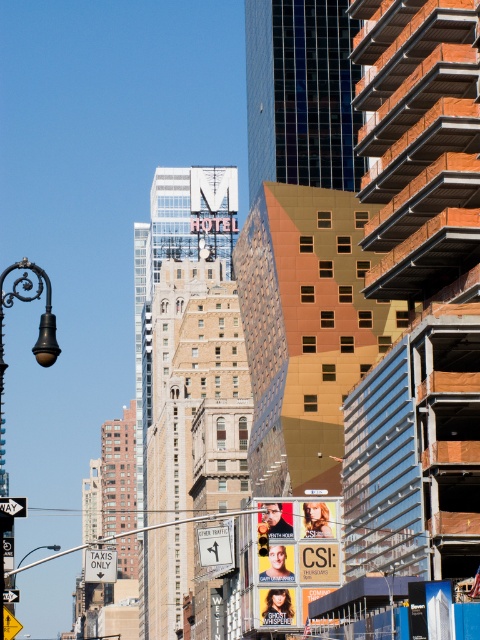
You are a city planner reviewing the urban layout. You need to install a new traffic light that must be taller than the existing black metal lamp post at left. Can the white plastic street sign at upper center accommodate this requirement?

The black metal lamp post at left is larger than the white plastic street sign at upper center, so the traffic light cannot be installed on the white plastic street sign at upper center because it is smaller and may not meet the height requirement.

You are standing on the sidewalk and see the metallic gold billboard at center and the black metal lamp post at left. Which object is closer to you?

The metallic gold billboard at center is closer to you because it is further to the viewer than the black metal lamp post at left.